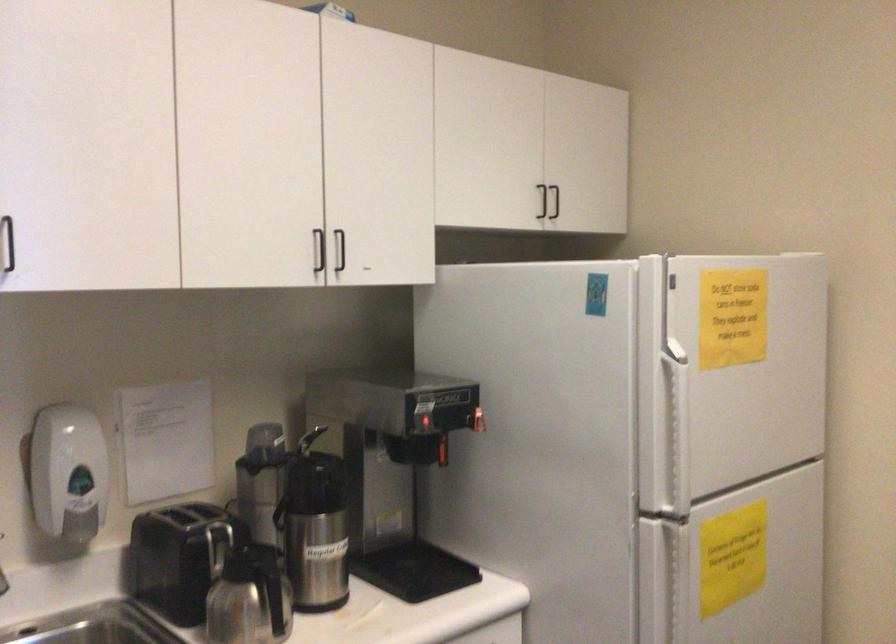
This screenshot has width=896, height=644. In order to click on thermal carafe lever in this screenshot , I will do [x=280, y=511].